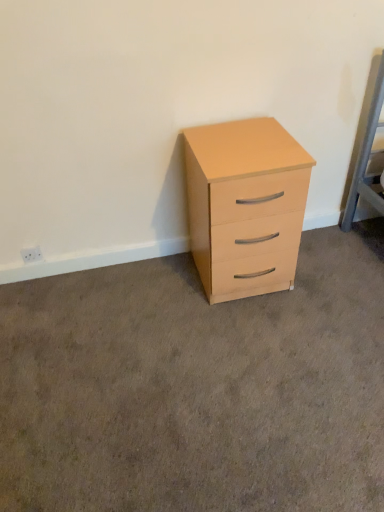
Question: Does light wood/finish chest of drawers at center have a lesser width compared to light wood drawer at center?

Choices:
 (A) yes
 (B) no

Answer: (A)

Question: Is light wood/finish chest of drawers at center closer to the viewer compared to light wood drawer at center?

Choices:
 (A) yes
 (B) no

Answer: (B)

Question: Is light wood/finish chest of drawers at center far from light wood drawer at center?

Choices:
 (A) no
 (B) yes

Answer: (A)

Question: From the image's perspective, is light wood/finish chest of drawers at center under light wood drawer at center?

Choices:
 (A) no
 (B) yes

Answer: (A)

Question: Is light wood/finish chest of drawers at center bigger than light wood drawer at center?

Choices:
 (A) yes
 (B) no

Answer: (A)

Question: Would you say light wood/finish chest of drawers at center contains light wood drawer at center?

Choices:
 (A) yes
 (B) no

Answer: (B)

Question: Does light wood drawer at center appear on the left side of light wood/finish chest of drawers at center?

Choices:
 (A) no
 (B) yes

Answer: (A)

Question: Can you confirm if light wood drawer at center is thinner than light wood/finish chest of drawers at center?

Choices:
 (A) no
 (B) yes

Answer: (A)

Question: Can you confirm if light wood drawer at center is wider than light wood/finish chest of drawers at center?

Choices:
 (A) no
 (B) yes

Answer: (B)

Question: Is the position of light wood drawer at center more distant than that of light wood/finish chest of drawers at center?

Choices:
 (A) yes
 (B) no

Answer: (B)

Question: Can you confirm if light wood drawer at center is bigger than light wood/finish chest of drawers at center?

Choices:
 (A) no
 (B) yes

Answer: (A)

Question: Is light wood drawer at center not within light wood/finish chest of drawers at center?

Choices:
 (A) yes
 (B) no

Answer: (A)

Question: From a real-world perspective, is light wood/finish chest of drawers at center positioned above or below light wood drawer at center?

Choices:
 (A) below
 (B) above

Answer: (B)